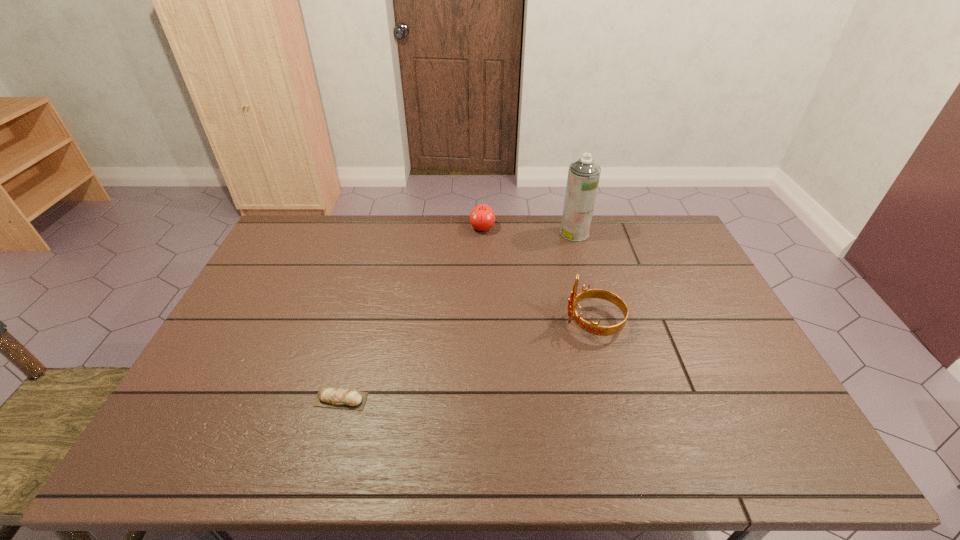
Locate an element on the screen. This screenshot has width=960, height=540. vacant region located 0.240m on the front-facing side of the second nearest object is located at coordinates (482, 322).

Identify the location of free space located on the left of the second object from left to right. [398, 228].

Locate an element on the screen. free space located on the back of the nearest object is located at coordinates (353, 354).

Locate an element on the screen. Image resolution: width=960 pixels, height=540 pixels. aerosol can present at the far edge is located at coordinates (583, 176).

You are a GUI agent. You are given a task and a screenshot of the screen. Output one action in this format:
    pyautogui.click(x=<x>, y=<y>)
    Task: Click on the apple located at the far edge
    Image resolution: width=960 pixels, height=540 pixels.
    Given the screenshot: What is the action you would take?
    pyautogui.click(x=482, y=217)

The width and height of the screenshot is (960, 540). Identify the location of free space at the far edge of the desktop. (460, 227).

What are the coordinates of `blank area at the near edge` in the screenshot? It's located at coord(686,437).

What are the coordinates of `free space at the left edge of the desktop` in the screenshot? It's located at (275, 287).

Identify the location of vacant space at the right edge of the desktop. (723, 334).

Identify the location of vacant space at the near left corner of the desktop. (171, 436).